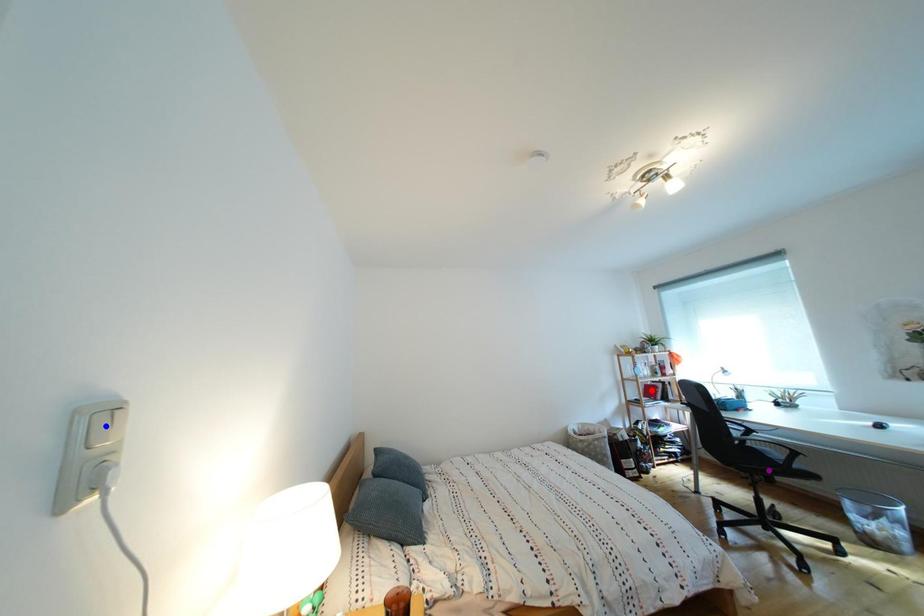
Order these from nearest to farthest:
- red point
- purple point
- blue point

1. blue point
2. purple point
3. red point